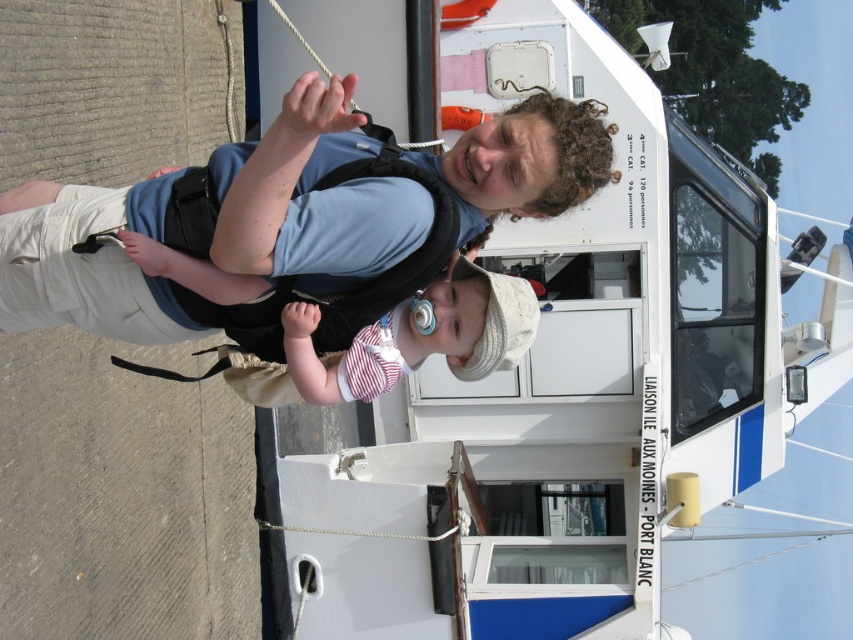
Question: Can you confirm if blue fabric vest at center is positioned to the left of white cotton hat at center?

Choices:
 (A) yes
 (B) no

Answer: (A)

Question: Among these points, which one is farthest from the camera?

Choices:
 (A) (360, 157)
 (B) (502, 321)

Answer: (B)

Question: Is blue fabric vest at center wider than white cotton hat at center?

Choices:
 (A) yes
 (B) no

Answer: (A)

Question: From the image, what is the correct spatial relationship of blue fabric vest at center in relation to white cotton hat at center?

Choices:
 (A) above
 (B) below

Answer: (A)

Question: Which of the following is the closest to the observer?

Choices:
 (A) blue fabric vest at center
 (B) white cotton hat at center

Answer: (A)